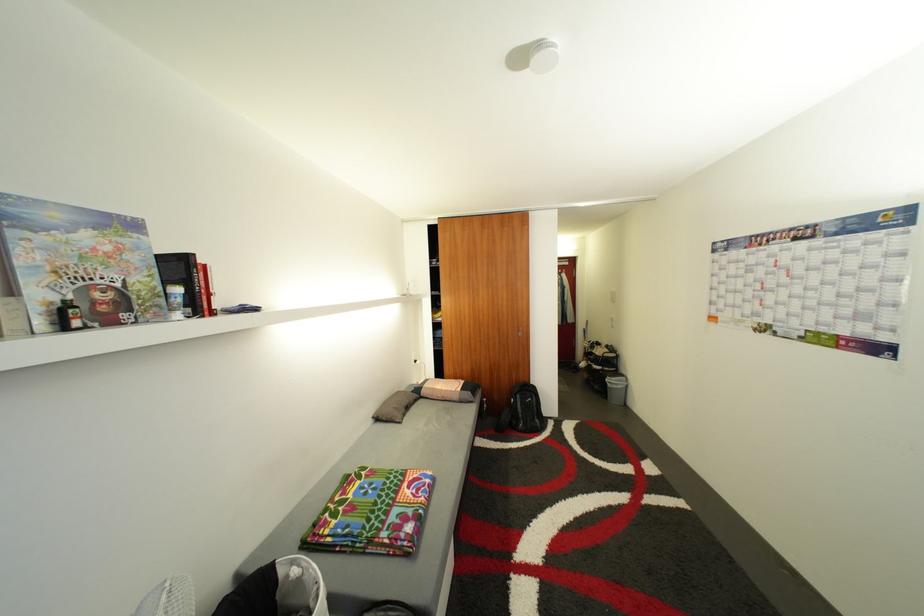
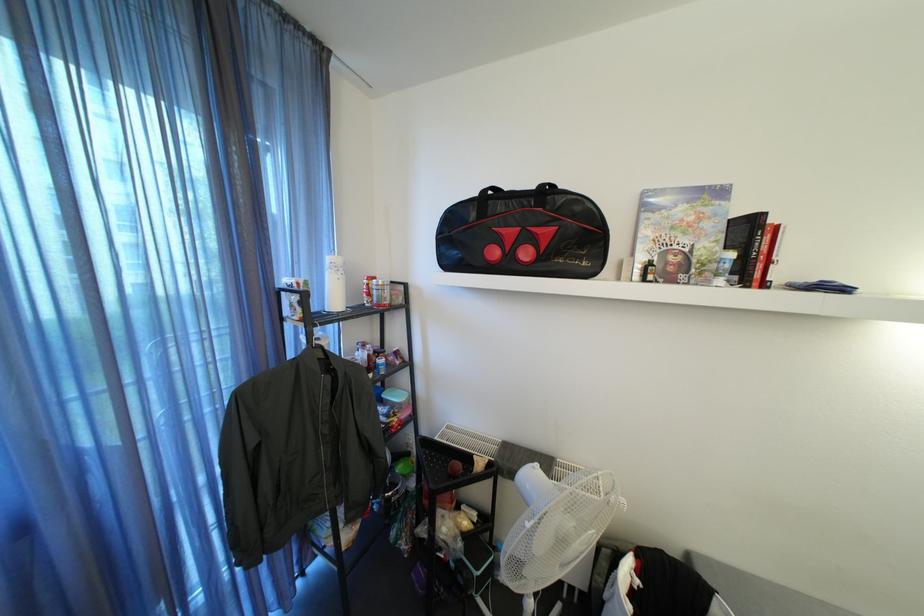
Question: The images are taken continuously from a first-person perspective. In which direction is your viewpoint rotating?

Choices:
 (A) Left
 (B) Right
 (C) Up
 (D) Down

Answer: (A)